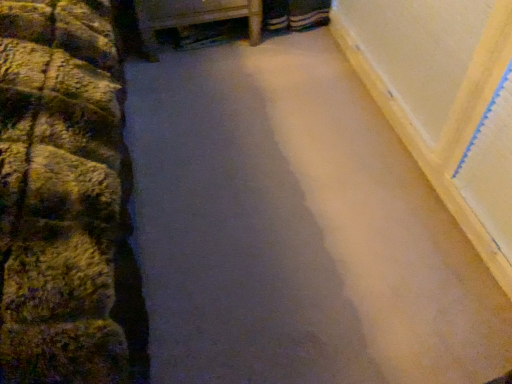
The width and height of the screenshot is (512, 384). Describe the element at coordinates (193, 17) in the screenshot. I see `wooden bed frame at upper center` at that location.

Find the location of a particular element. The width and height of the screenshot is (512, 384). wooden bed frame at upper center is located at coordinates (193, 17).

Locate an element on the screen. This screenshot has width=512, height=384. wooden bed frame at upper center is located at coordinates (193, 17).